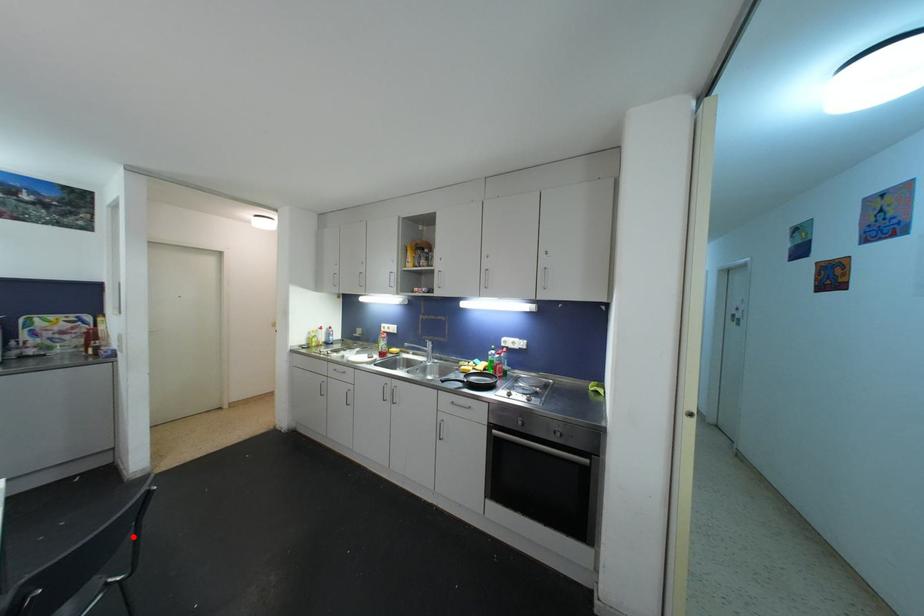
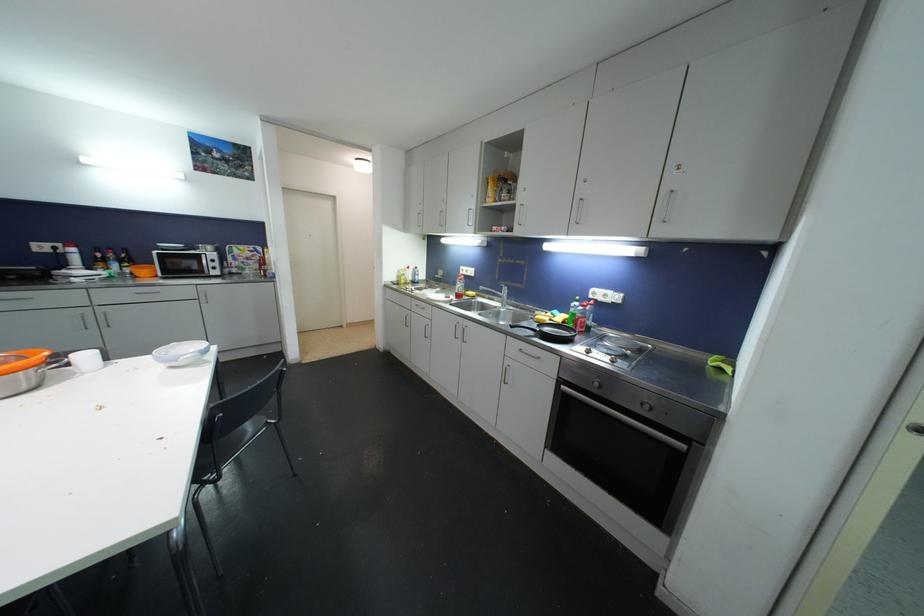
Locate, in the second image, the point that corresponds to the highlighted location in the first image.

(278, 399)